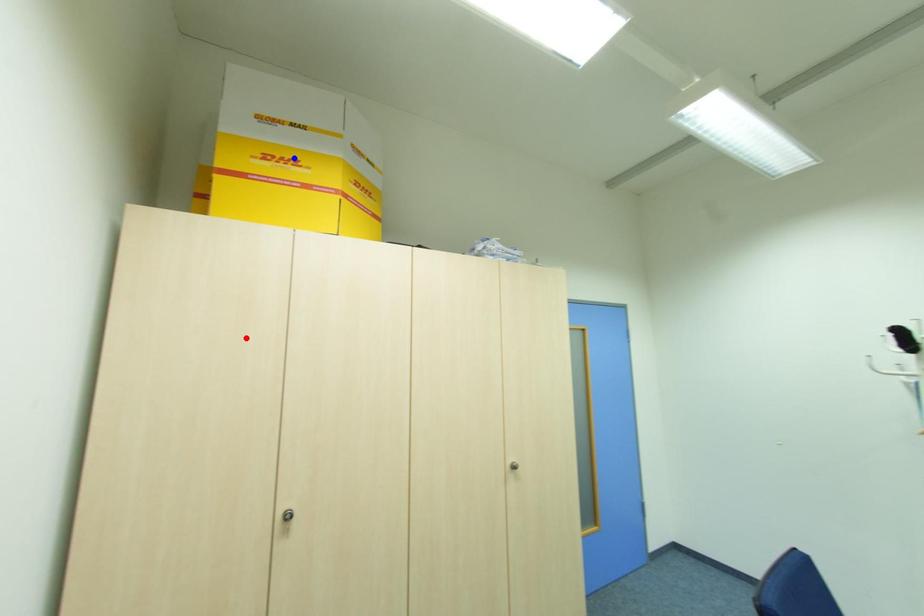
Question: Two points are marked on the image. Which point is closer to the camera?

Choices:
 (A) Blue point is closer.
 (B) Red point is closer.

Answer: (B)